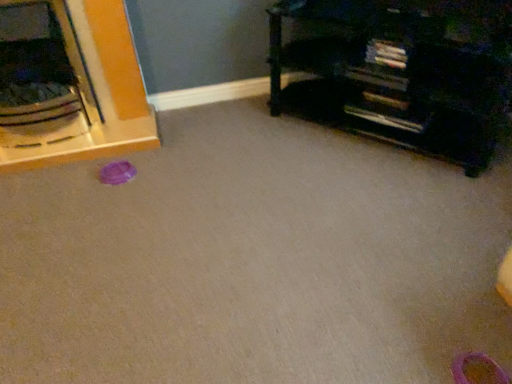
Image resolution: width=512 pixels, height=384 pixels. I want to click on free space between black matte bookshelf at upper right, the 1th furniture positioned from the right, and pink rubber shoe at lower right, so click(x=397, y=211).